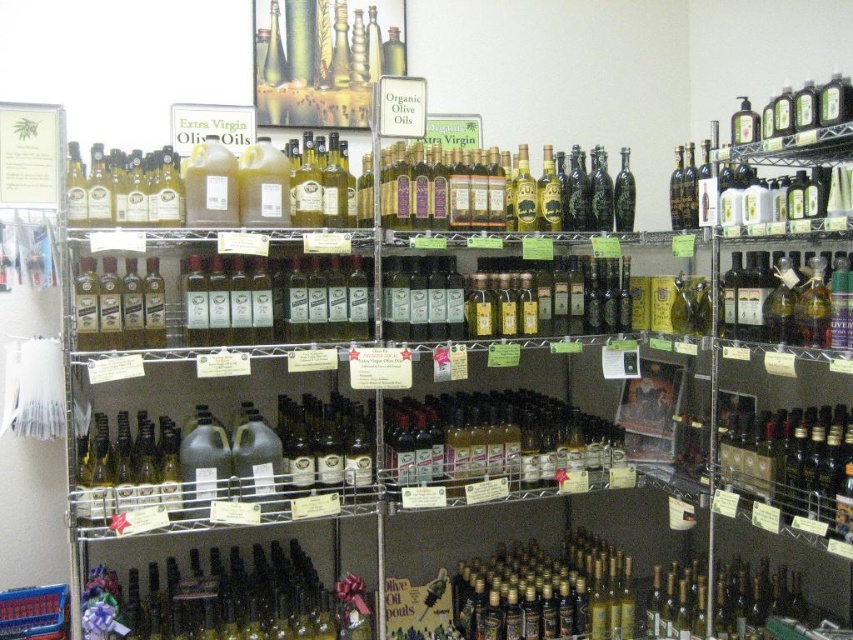
Question: Which point is closer to the camera?

Choices:
 (A) matte glass bottle at center-right
 (B) matte glass bottles at upper left

Answer: (A)

Question: Is translucent glass bottles at lower center below matte glass bottle at center-right?

Choices:
 (A) yes
 (B) no

Answer: (A)

Question: In this image, where is translucent glass bottles at lower center located relative to matte glass bottle at center-right?

Choices:
 (A) above
 (B) below

Answer: (B)

Question: From the image, what is the correct spatial relationship of matte glass bottle at center-right in relation to matte glass bottles at upper left?

Choices:
 (A) left
 (B) right

Answer: (B)

Question: Which of the following is the closest to the observer?

Choices:
 (A) (277, 576)
 (B) (779, 477)

Answer: (B)

Question: Estimate the real-world distances between objects in this image. Which object is farther from the matte glass bottles at upper left?

Choices:
 (A) matte glass bottle at center-right
 (B) translucent glass bottles at lower center

Answer: (A)